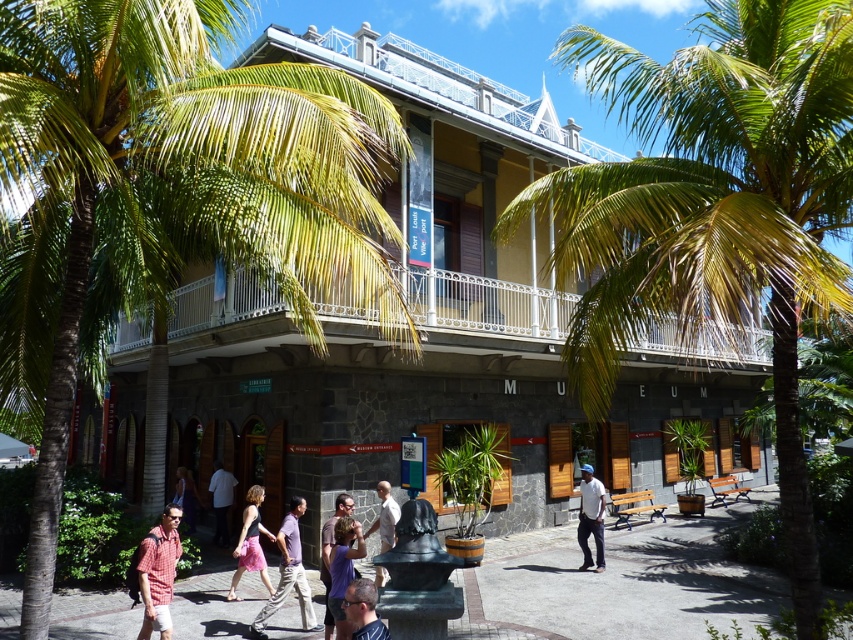
Question: Among these objects, which one is farthest from the camera?

Choices:
 (A) white shirt at center
 (B) light brown wooden statue at center
 (C) matte purple shirt at center
 (D) matte black top at center

Answer: (A)

Question: Which point is closer to the camera?

Choices:
 (A) matte black hair at center
 (B) dark gray stone building at center
 (C) matte black top at center

Answer: (A)

Question: Does plaid shirt at lower left have a greater width compared to white matte shirt at center?

Choices:
 (A) yes
 (B) no

Answer: (A)

Question: Does matte purple shirt at center have a smaller size compared to matte white shirt at center?

Choices:
 (A) yes
 (B) no

Answer: (A)

Question: Is dark gray stone building at center closer to camera compared to white matte shirt at center?

Choices:
 (A) no
 (B) yes

Answer: (B)

Question: Which object is the closest to the white shirt at center?

Choices:
 (A) white matte shirt at center
 (B) matte purple shirt at center
 (C) light brown wooden statue at center
 (D) dark gray stone building at center

Answer: (C)